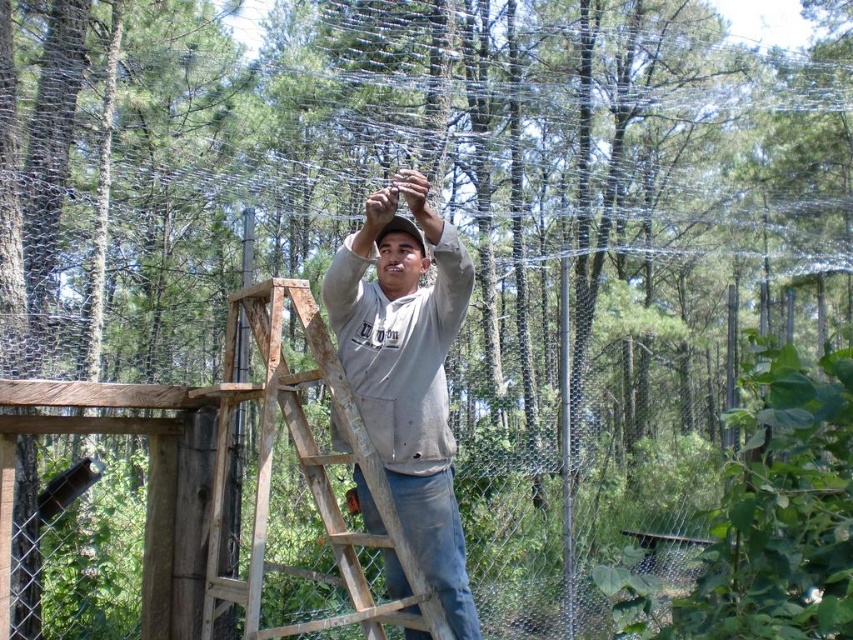
Question: Can you confirm if gray sweatshirt at center is positioned to the left of wooden at center?

Choices:
 (A) no
 (B) yes

Answer: (A)

Question: Observing the image, what is the correct spatial positioning of gray sweatshirt at center in reference to wooden at center?

Choices:
 (A) left
 (B) right

Answer: (B)

Question: Among these objects, which one is nearest to the camera?

Choices:
 (A) gray sweatshirt at center
 (B) wooden at center

Answer: (B)

Question: Which of the following is the closest to the observer?

Choices:
 (A) gray sweatshirt at center
 (B) wooden at center

Answer: (B)

Question: Which of the following is the farthest from the observer?

Choices:
 (A) (392, 497)
 (B) (347, 456)

Answer: (A)

Question: Does gray sweatshirt at center have a larger size compared to wooden at center?

Choices:
 (A) no
 (B) yes

Answer: (A)